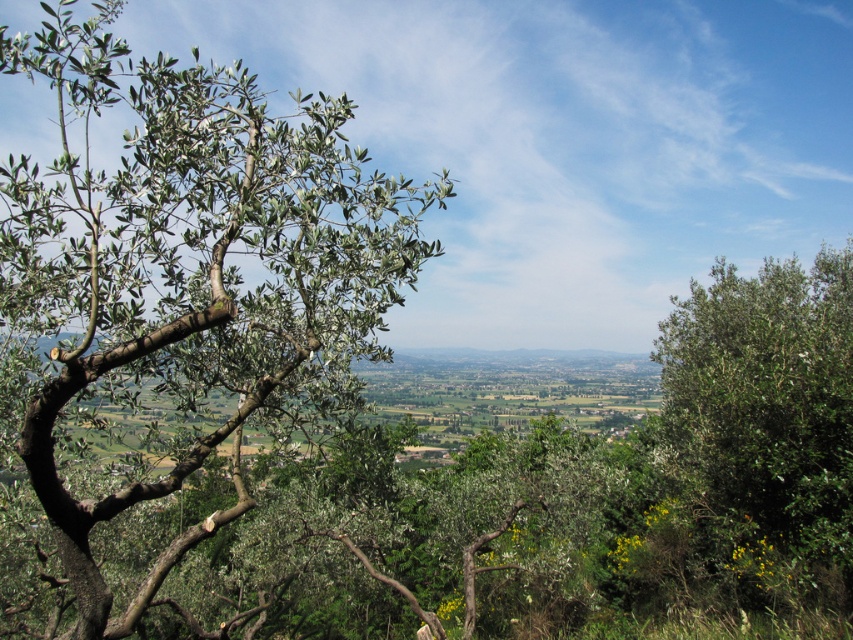
Question: Is green leafy tree at left below green leafy tree at right?

Choices:
 (A) no
 (B) yes

Answer: (A)

Question: Can you confirm if green leafy tree at left is positioned to the left of green leafy tree at right?

Choices:
 (A) yes
 (B) no

Answer: (A)

Question: Among these points, which one is nearest to the camera?

Choices:
 (A) (57, 515)
 (B) (836, 570)

Answer: (A)

Question: Which point is farther from the camera taking this photo?

Choices:
 (A) (306, 360)
 (B) (682, 460)

Answer: (B)

Question: Can you confirm if green leafy tree at left is positioned below green leafy tree at right?

Choices:
 (A) yes
 (B) no

Answer: (B)